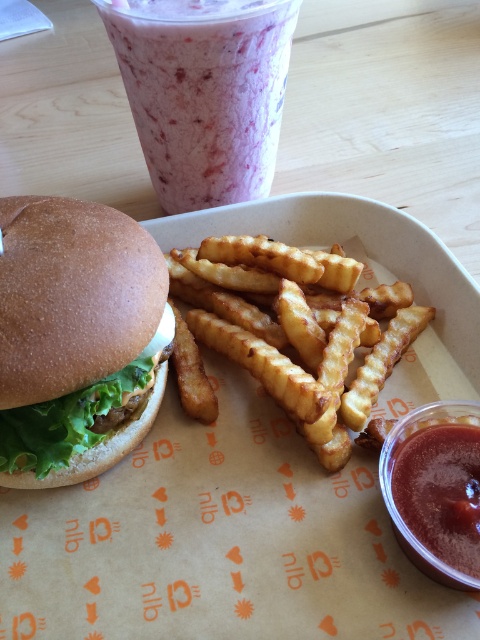
You are a food delivery person who needs to place a hot plate on the table without touching the golden crispy fries at center or the smooth tomato sauce at lower right. The plate has a diameter of 10 inches. Is there enough space between them to place the plate?

The distance between the golden crispy fries at center and the smooth tomato sauce at lower right is 8.95 inches, which is less than the plate diameter of 10 inches. Therefore, placing the plate between them would not be possible without overlapping either item.

You are a food delivery person and need to place a new order on the table. The new order must be placed at the coordinate point specified by the system. The system tells you to place the new order at point (76, 337). Where exactly should you place the new order on the table?

The point (76, 337) corresponds to the brown matte burger at left, so you should place the new order directly on top of the brown matte burger at left.

You are a food delivery person who needs to pack the brown matte burger at left and the pink smoothie at upper center into a box. The box can only hold items where the burger is smaller than the smoothie. Can you safely place both items in the box?

A: The brown matte burger at left has a smaller size compared to the pink smoothie at upper center, so yes, the box can safely hold both items since the burger is smaller than the smoothie.